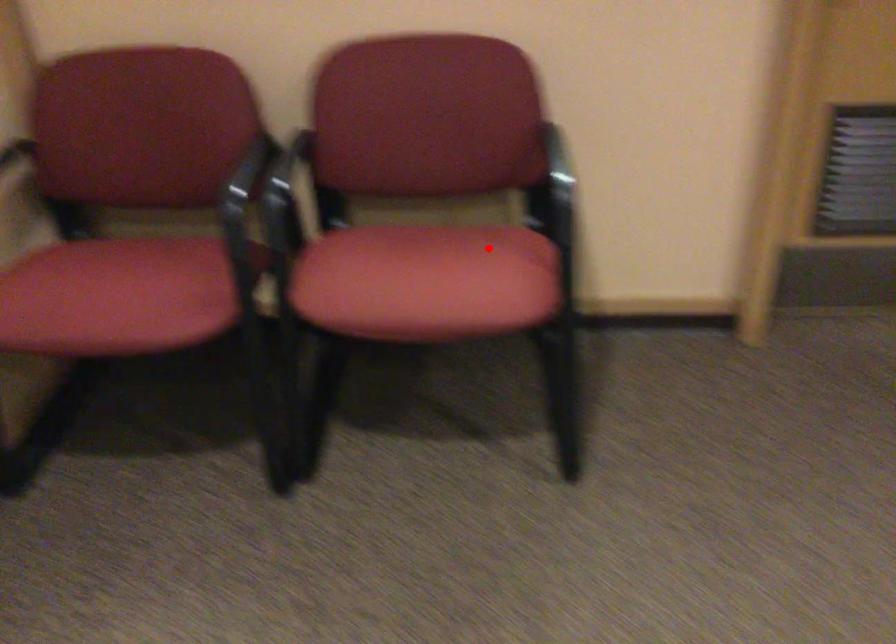
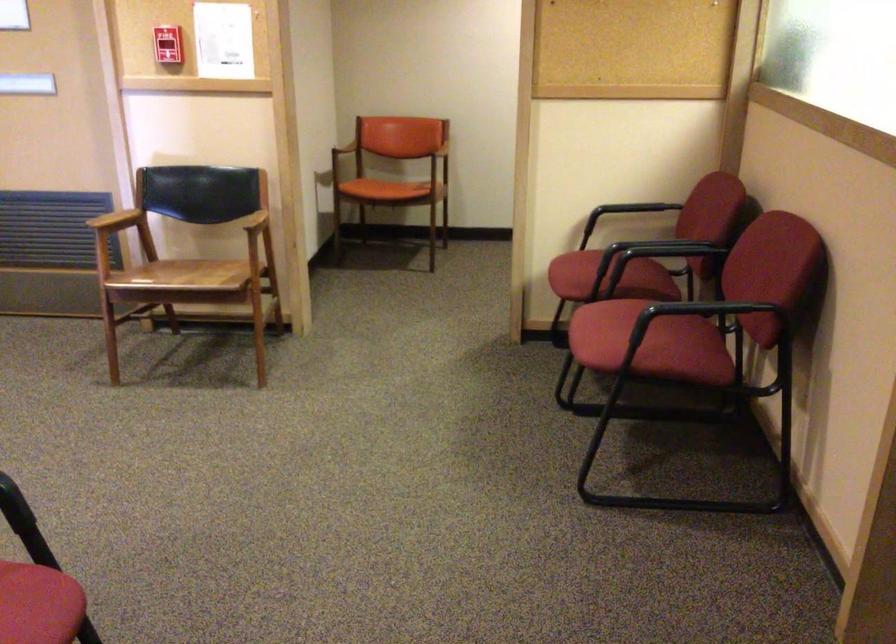
Question: I am providing you with two images of the same scene from different viewpoints. A red point is shown in image1. For the corresponding object point in image2, is it positioned nearer or farther from the camera?

Choices:
 (A) Nearer
 (B) Farther

Answer: (B)